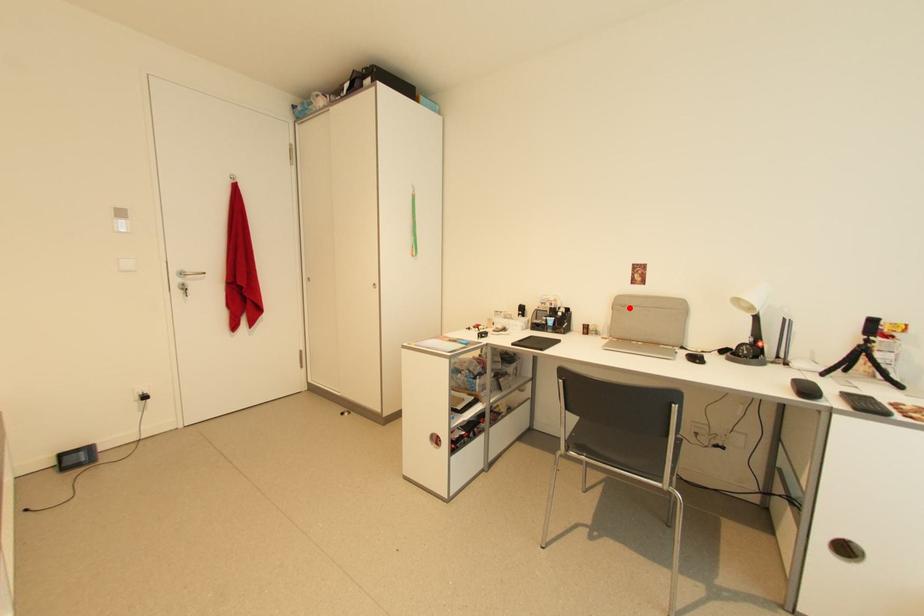
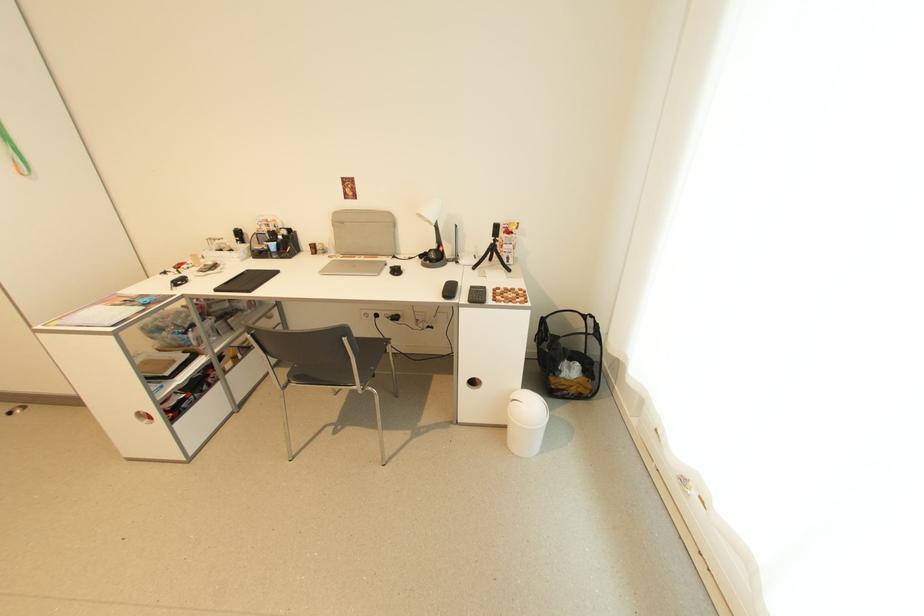
Where in the second image is the point corresponding to the highlighted location from the first image?

(347, 224)